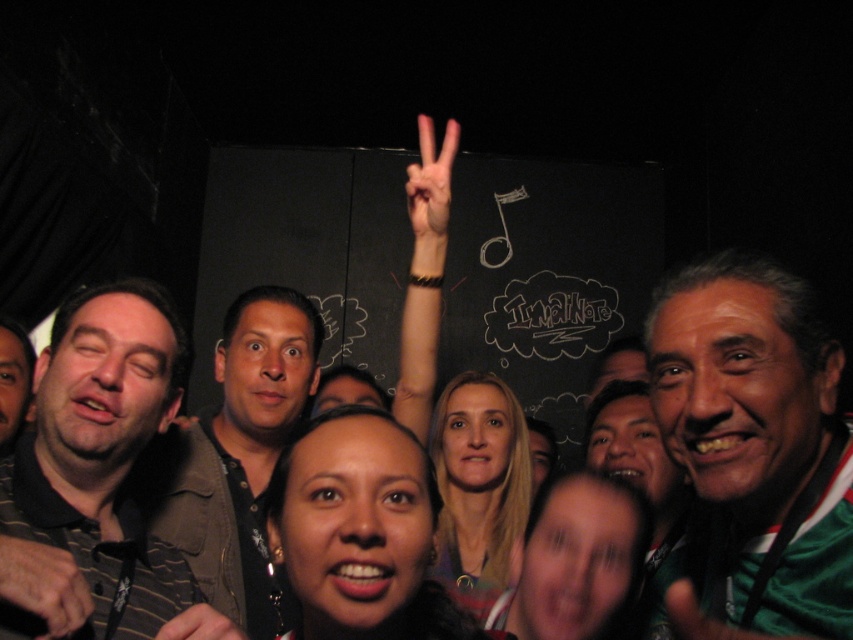
Looking at this image, which is below, striped polo shirt at left or white matte hand at upper center?

striped polo shirt at left

How distant is striped polo shirt at left from white matte hand at upper center?

They are 35.69 inches apart.

Between point (45, 461) and point (444, 188), which one is positioned behind?

Positioned behind is point (444, 188).

Find the location of a particular element. striped polo shirt at left is located at coordinates (103, 452).

Looking at this image, who is lower down, dark brown leather hand at lower left or smooth skin hand at center?

smooth skin hand at center

Which of these two, dark brown leather hand at lower left or smooth skin hand at center, stands shorter?

Standing shorter between the two is smooth skin hand at center.

In order to click on dark brown leather hand at lower left in this screenshot , I will do `click(44, 582)`.

This screenshot has width=853, height=640. I want to click on striped polo shirt at left, so click(103, 452).

Is striped polo shirt at left thinner than brown leather jacket at center?

Indeed, striped polo shirt at left has a lesser width compared to brown leather jacket at center.

Between point (41, 515) and point (155, 492), which one is positioned in front?

Positioned in front is point (41, 515).

This screenshot has height=640, width=853. In order to click on striped polo shirt at left in this screenshot , I will do tap(103, 452).